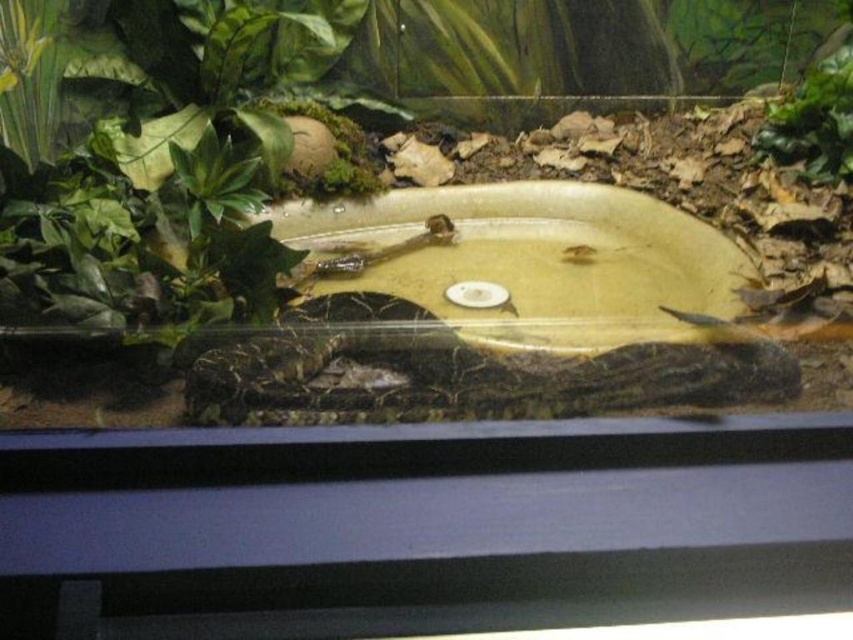
Is leathery brown snake at center smaller than green matte leaf at upper right?

No, leathery brown snake at center is not smaller than green matte leaf at upper right.

Can you confirm if leathery brown snake at center is wider than green matte leaf at upper right?

Indeed, leathery brown snake at center has a greater width compared to green matte leaf at upper right.

Is point (607, 356) in front of point (795, 157)?

Yes, it is.

At what (x,y) coordinates should I click in order to perform the action: click on leathery brown snake at center. Please return your answer as a coordinate pair (x, y). This screenshot has width=853, height=640. Looking at the image, I should click on (476, 376).